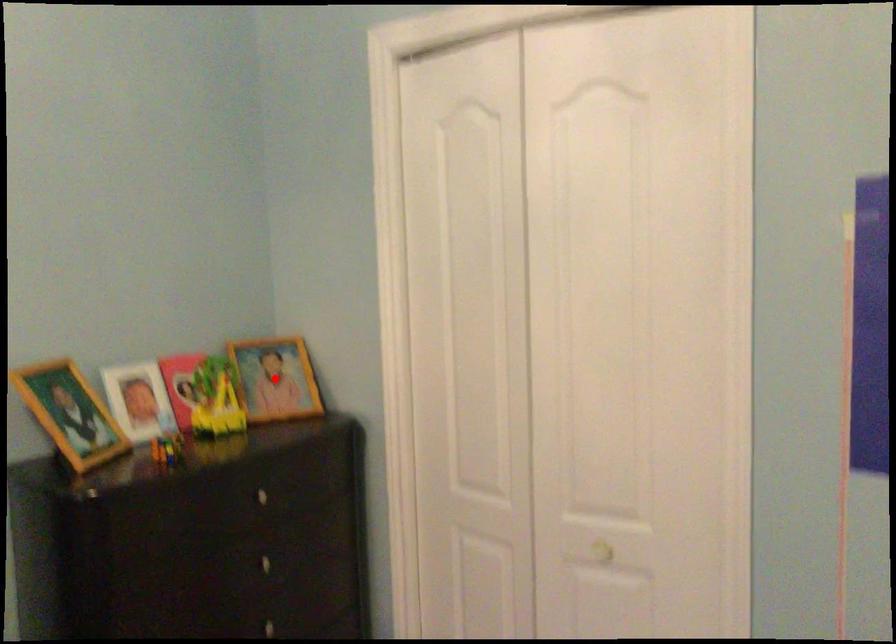
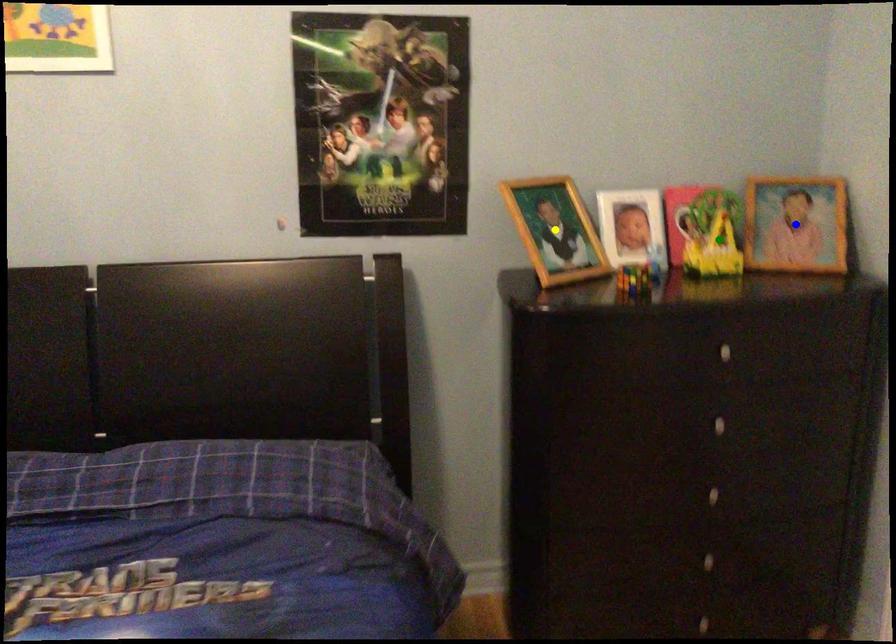
Question: I am providing you with two images of the same scene from different viewpoints. A red point is marked on the first image. You are given multiple points on the second image. Which spot in image 2 lines up with the point in image 1?

Choices:
 (A) yellow point
 (B) blue point
 (C) green point

Answer: (B)